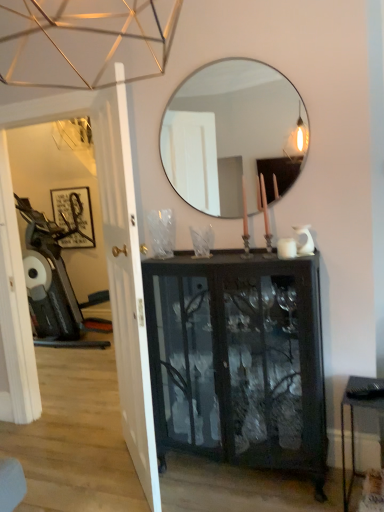
Identify the location of free space between metallic black table at lower right and black glass cabinet at center. This screenshot has width=384, height=512. (324, 490).